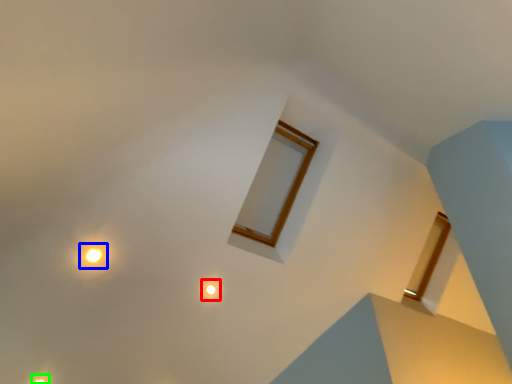
Question: Considering the real-world distances, which object is closest to light (highlighted by a red box)? light (highlighted by a blue box) or light (highlighted by a green box).

Choices:
 (A) light
 (B) light

Answer: (A)